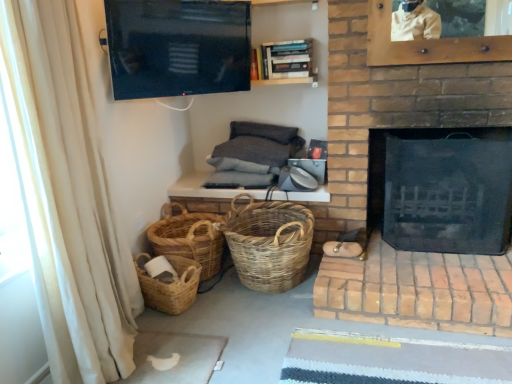
Question: Is wooden bookshelf at upper center completely or partially outside of reddish-brown brick at right?

Choices:
 (A) no
 (B) yes

Answer: (B)

Question: Is wooden bookshelf at upper center shorter than reddish-brown brick at right?

Choices:
 (A) yes
 (B) no

Answer: (B)

Question: Is wooden bookshelf at upper center at the right side of reddish-brown brick at right?

Choices:
 (A) yes
 (B) no

Answer: (B)

Question: Is there a large distance between wooden bookshelf at upper center and reddish-brown brick at right?

Choices:
 (A) yes
 (B) no

Answer: (A)

Question: Is wooden bookshelf at upper center oriented away from reddish-brown brick at right?

Choices:
 (A) no
 (B) yes

Answer: (A)

Question: Is the depth of wooden bookshelf at upper center less than that of reddish-brown brick at right?

Choices:
 (A) no
 (B) yes

Answer: (A)

Question: Would you say woven natural basket at center, which appears as the 3th basket when viewed from the left, contains flat-screen tv at upper center?

Choices:
 (A) no
 (B) yes

Answer: (A)

Question: Is woven natural basket at center, placed as the first basket when sorted from right to left, positioned behind flat-screen tv at upper center?

Choices:
 (A) no
 (B) yes

Answer: (B)

Question: Does woven natural basket at center, placed as the first basket when sorted from right to left, appear on the right side of flat-screen tv at upper center?

Choices:
 (A) yes
 (B) no

Answer: (A)

Question: Considering the relative sizes of woven natural basket at center, which appears as the 3th basket when viewed from the left, and flat-screen tv at upper center in the image provided, is woven natural basket at center, which appears as the 3th basket when viewed from the left, wider than flat-screen tv at upper center?

Choices:
 (A) yes
 (B) no

Answer: (A)

Question: Could you tell me if woven natural basket at center, placed as the first basket when sorted from right to left, is facing flat-screen tv at upper center?

Choices:
 (A) no
 (B) yes

Answer: (A)

Question: From a real-world perspective, is woven natural basket at center, which appears as the 3th basket when viewed from the left, physically above flat-screen tv at upper center?

Choices:
 (A) yes
 (B) no

Answer: (B)

Question: From a real-world perspective, is wooden bookshelf at upper center over flat-screen tv at upper center?

Choices:
 (A) no
 (B) yes

Answer: (A)